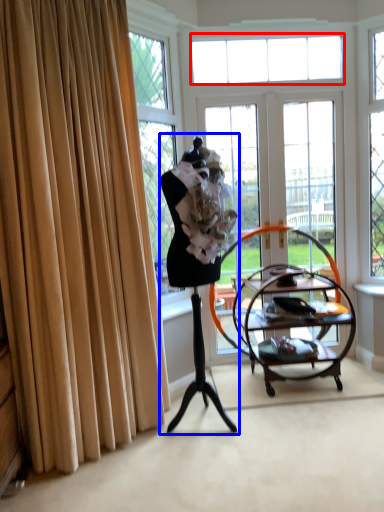
Question: Which object appears closest to the camera in this image, window (highlighted by a red box) or woman (highlighted by a blue box)?

Choices:
 (A) window
 (B) woman

Answer: (B)